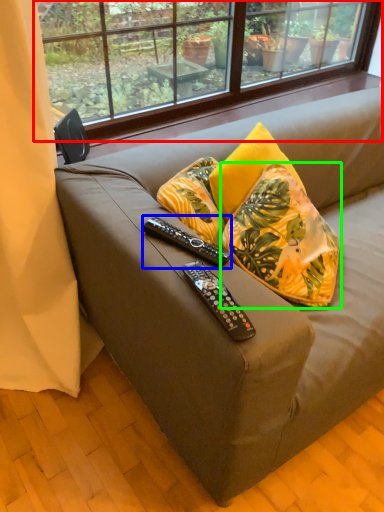
Question: Which object is positioned farthest from window (highlighted by a red box)? Select from remote control (highlighted by a blue box) and pillow (highlighted by a green box).

Choices:
 (A) remote control
 (B) pillow

Answer: (A)